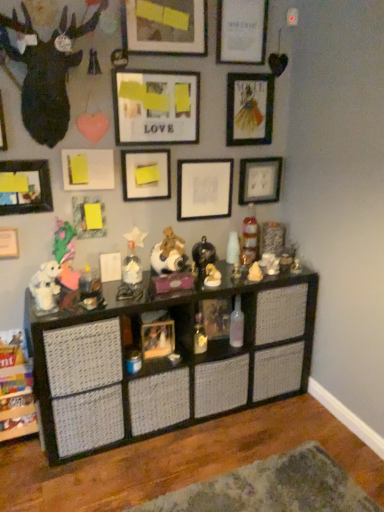
What are the coordinates of `free space in front of black woven shelf at center` in the screenshot? It's located at (166, 462).